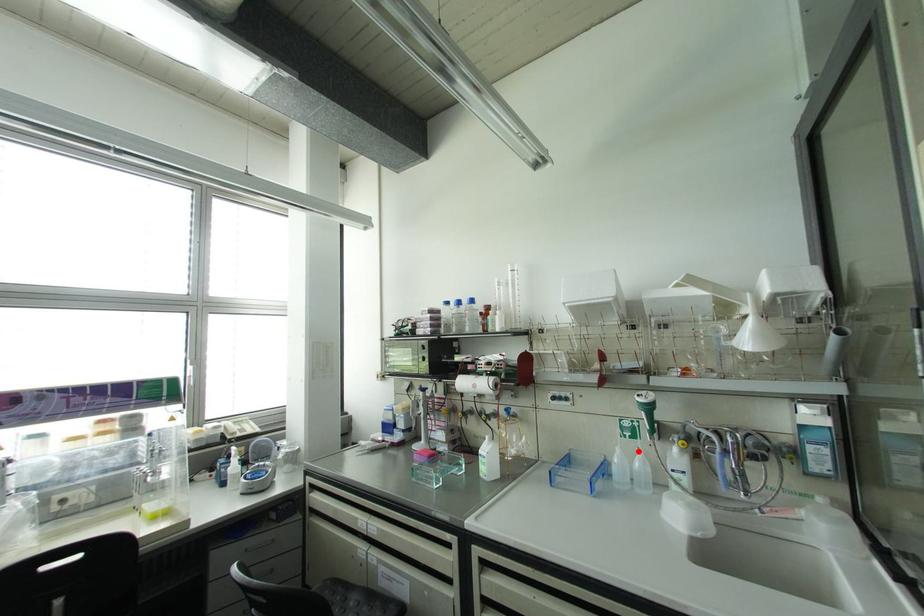
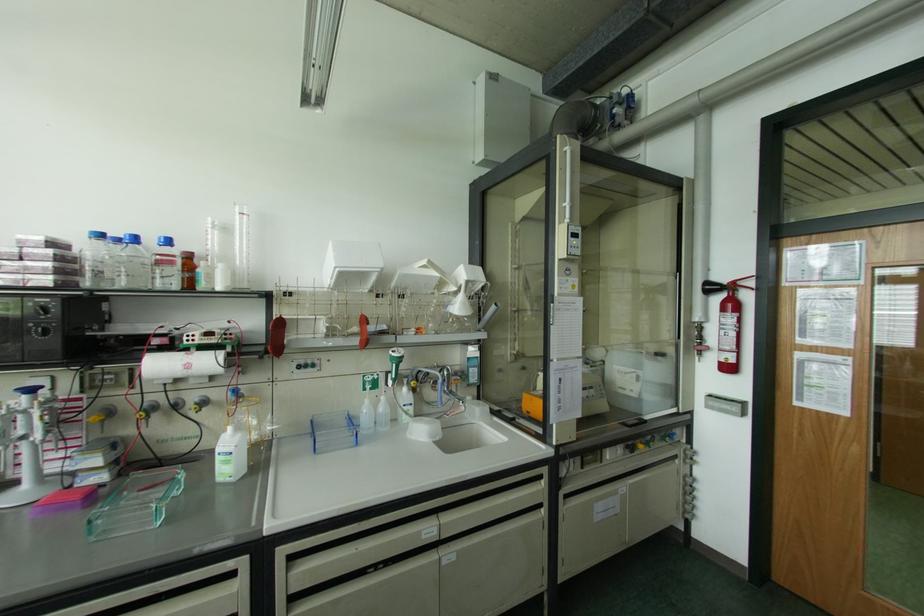
Where in the second image is the point corresponding to the highlighted location from the first image?

(382, 398)